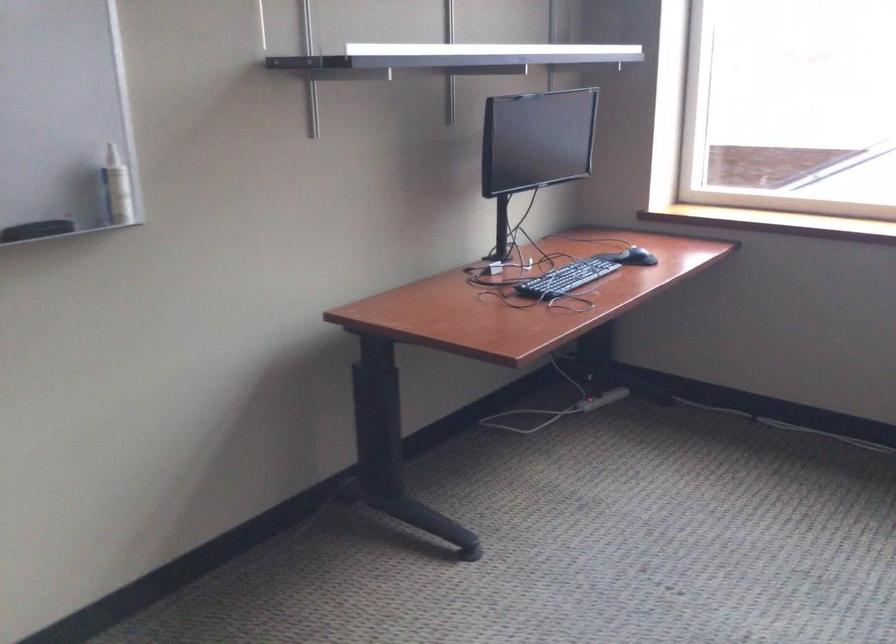
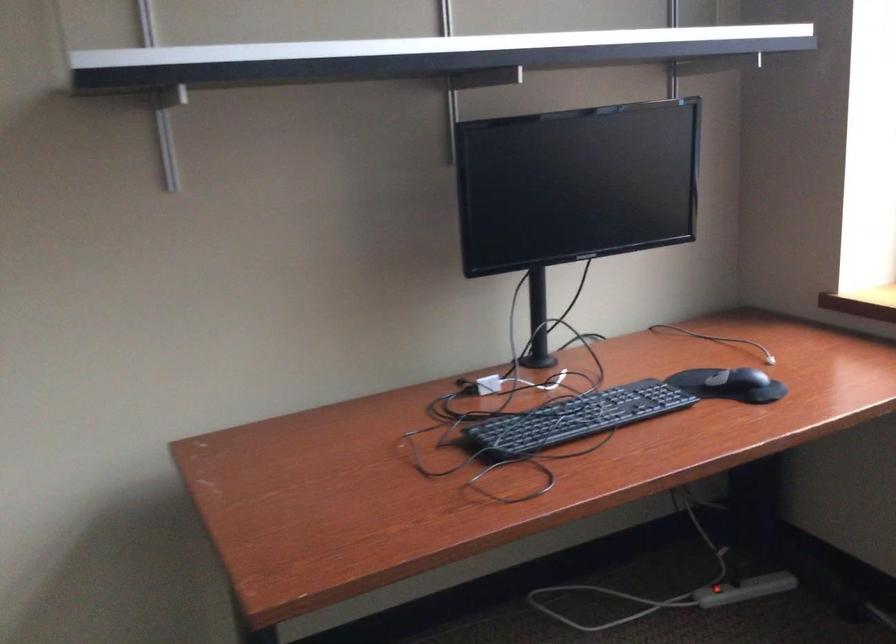
What movement of the cameraman would produce the second image?

The cameraman moved toward right, forward.